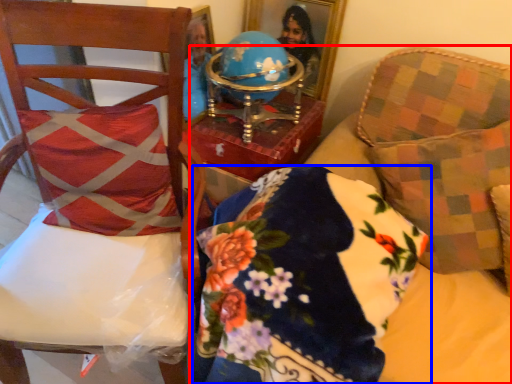
Question: Which point is further to the camera, furniture (highlighted by a red box) or pillow (highlighted by a blue box)?

Choices:
 (A) furniture
 (B) pillow

Answer: (B)